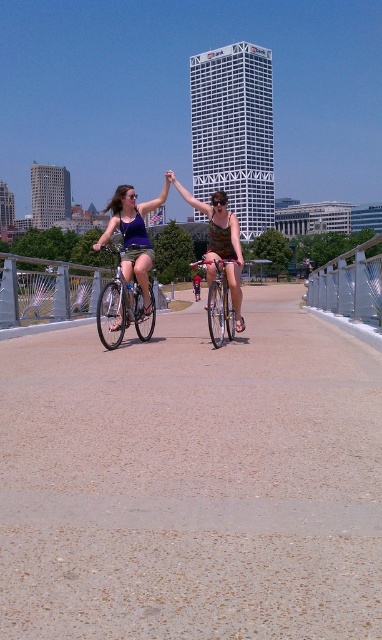
Between camouflage fabric dress at center and silver metallic bicycle at center, which one is positioned lower?

silver metallic bicycle at center is below.

What do you see at coordinates (220, 243) in the screenshot? I see `camouflage fabric dress at center` at bounding box center [220, 243].

The height and width of the screenshot is (640, 382). In order to click on camouflage fabric dress at center in this screenshot , I will do `click(220, 243)`.

Looking at this image, which of these two, smooth concrete path at center or camouflage fabric dress at center, stands taller?

Standing taller between the two is camouflage fabric dress at center.

Does smooth concrete path at center have a smaller size compared to camouflage fabric dress at center?

Yes, smooth concrete path at center is smaller than camouflage fabric dress at center.

Where is `smooth concrete path at center`? The image size is (382, 640). smooth concrete path at center is located at coordinates (192, 481).

Does point (210, 266) come closer to viewer compared to point (226, 292)?

Yes, point (210, 266) is closer to viewer.

Can you confirm if camouflage fabric dress at center is taller than shiny silver bicycle at center?

Indeed, camouflage fabric dress at center has a greater height compared to shiny silver bicycle at center.

The image size is (382, 640). What do you see at coordinates (220, 243) in the screenshot? I see `camouflage fabric dress at center` at bounding box center [220, 243].

The width and height of the screenshot is (382, 640). I want to click on camouflage fabric dress at center, so click(220, 243).